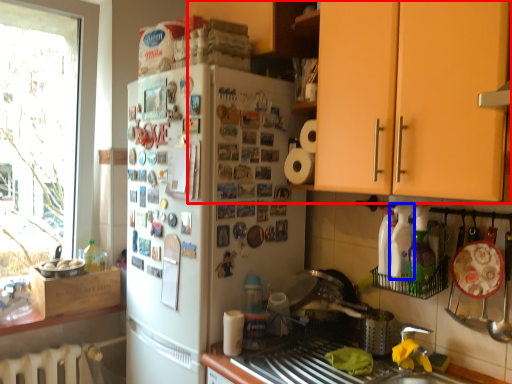
Question: Which object is closer to the camera taking this photo, cabinetry (highlighted by a red box) or bottle (highlighted by a blue box)?

Choices:
 (A) cabinetry
 (B) bottle

Answer: (A)